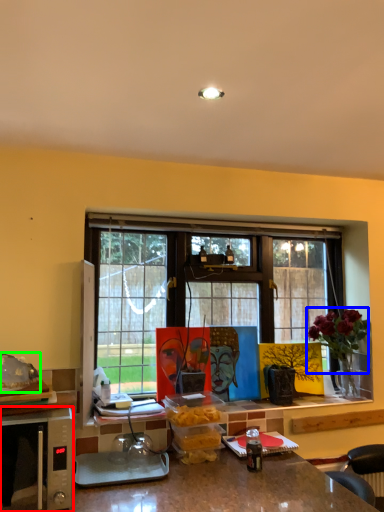
Question: Which is nearer to the microwave oven (highlighted by a red box)? flower (highlighted by a blue box) or food (highlighted by a green box).

Choices:
 (A) flower
 (B) food

Answer: (B)